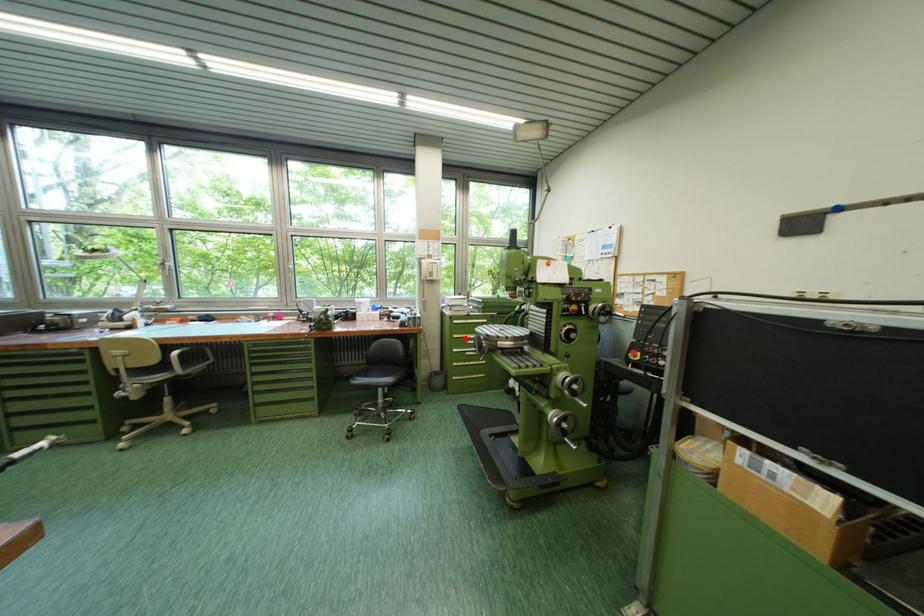
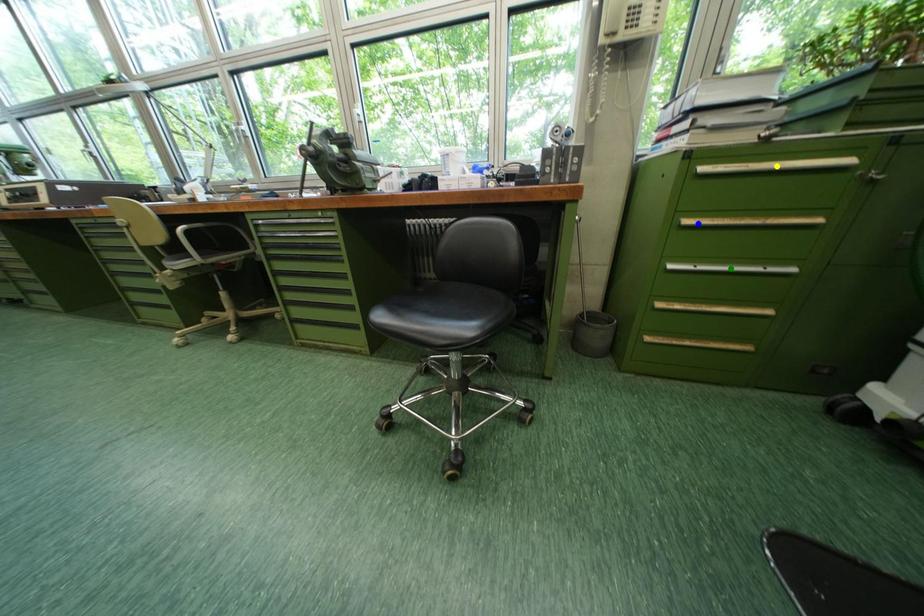
Question: I am providing you with two images of the same scene from different viewpoints. A red point is marked on the first image. You are given multiple points on the second image. In image 2, which mark is for the same physical point as the one in image 1?

Choices:
 (A) blue point
 (B) green point
 (C) yellow point

Answer: (A)